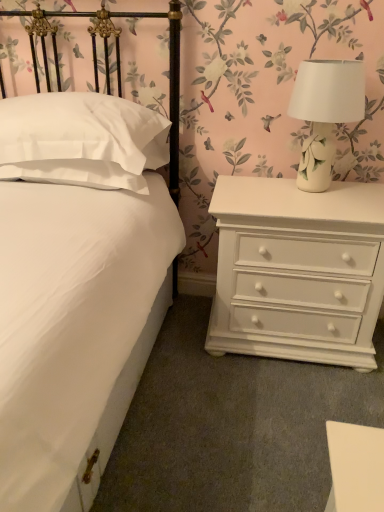
Where is `free location to the left of white ceramic lamp at upper right`? Image resolution: width=384 pixels, height=512 pixels. free location to the left of white ceramic lamp at upper right is located at coordinates (258, 187).